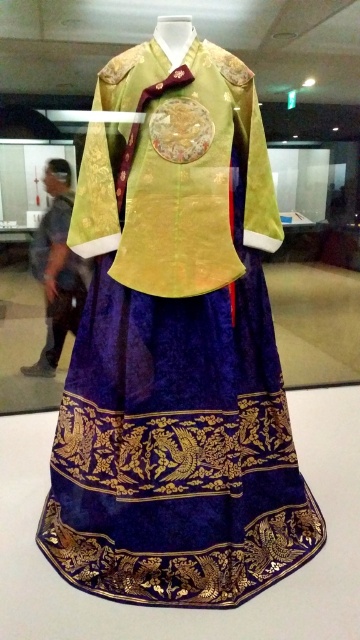
Is velvet gold brocade dress at center below velvet fabric dress at center?

Correct, velvet gold brocade dress at center is located below velvet fabric dress at center.

Who is more forward, (169, 589) or (57, 307)?

Point (169, 589) is in front.

Between point (176, 324) and point (72, 285), which one is positioned behind?

The point (72, 285) is behind.

Find the location of a particular element. The image size is (360, 640). velvet gold brocade dress at center is located at coordinates (176, 346).